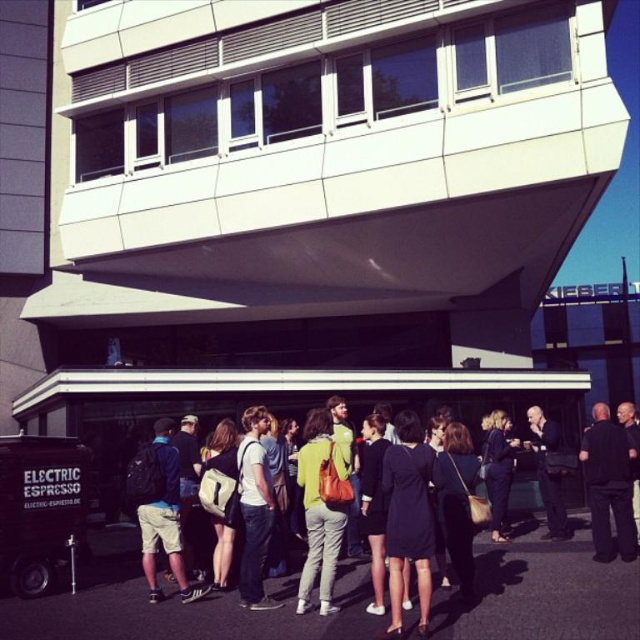
Question: Among these objects, which one is nearest to the camera?

Choices:
 (A) light blue denim shorts at lower left
 (B) dark blue leather jacket at lower right
 (C) matte black backpack at center
 (D) black dress at center

Answer: (D)

Question: Can you confirm if black dress at center is bigger than matte yellow jacket at center?

Choices:
 (A) no
 (B) yes

Answer: (B)

Question: Does matte black backpack at center appear on the right side of black dress at center?

Choices:
 (A) yes
 (B) no

Answer: (A)

Question: Which object is positioned farthest from the black fabric jacket at center?

Choices:
 (A) dark blue dress at center
 (B) matte black backpack at center

Answer: (B)

Question: Can you confirm if dark blue leather jacket at lower right is bigger than dark blue dress at center?

Choices:
 (A) yes
 (B) no

Answer: (B)

Question: Based on their relative distances, which object is nearer to the dark blue leather jacket at lower right?

Choices:
 (A) matte black backpack at center
 (B) matte yellow jacket at center

Answer: (A)